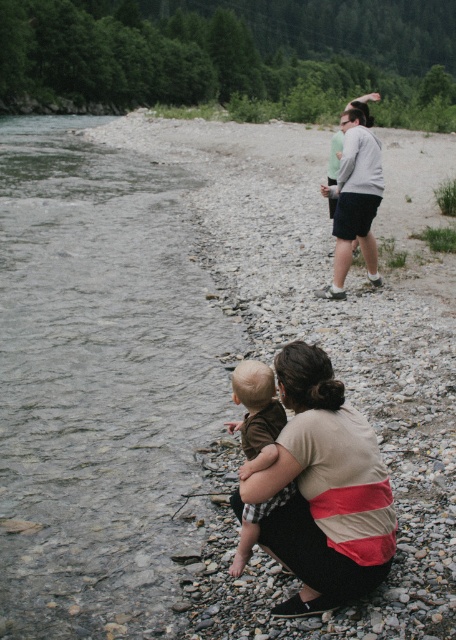
Is point (145, 236) in front of point (342, 600)?

No, it is behind (342, 600).

Does clear water at stream left appear on the right side of beige striped shirt at lower center?

In fact, clear water at stream left is to the left of beige striped shirt at lower center.

This screenshot has width=456, height=640. I want to click on clear water at stream left, so click(98, 384).

Does point (298, 392) come farther from viewer compared to point (244, 449)?

No, (298, 392) is closer to viewer.

Who is taller, beige striped shirt at lower center or brown cotton shirt at lower center?

beige striped shirt at lower center

Does point (257, 496) come in front of point (242, 476)?

Yes, it is in front of point (242, 476).

I want to click on beige striped shirt at lower center, so click(x=324, y=490).

Can you confirm if clear water at stream left is thinner than brown cotton shirt at lower center?

In fact, clear water at stream left might be wider than brown cotton shirt at lower center.

Can you confirm if clear water at stream left is bigger than brown cotton shirt at lower center?

Indeed, clear water at stream left has a larger size compared to brown cotton shirt at lower center.

Locate an element on the screen. The height and width of the screenshot is (640, 456). clear water at stream left is located at coordinates (98, 384).